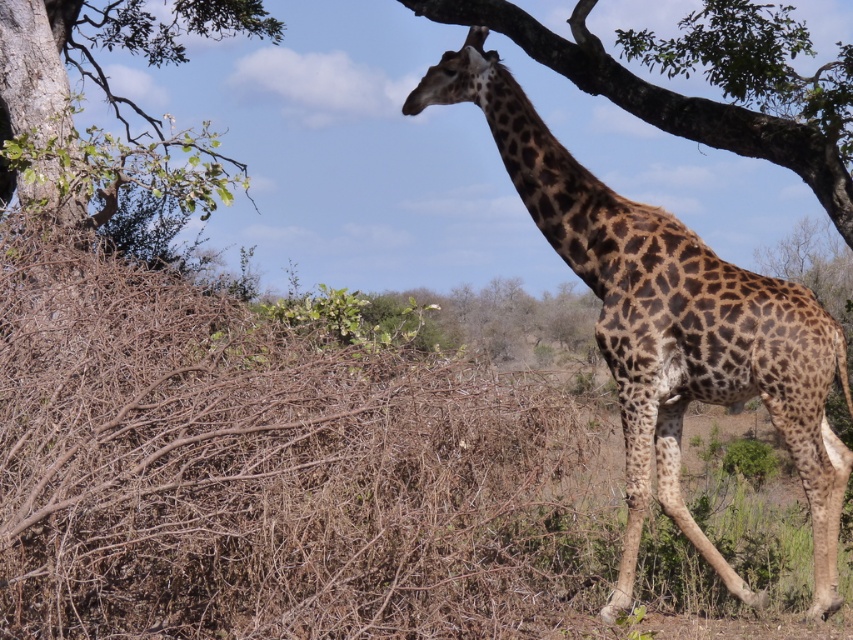
Which is below, spotted fur giraffe at center or green leafy tree at upper left?

spotted fur giraffe at center is lower down.

Is the position of spotted fur giraffe at center less distant than that of green leafy tree at upper left?

That is True.

Does point (631, 456) come farther from viewer compared to point (149, 186)?

No.

Where is `spotted fur giraffe at center`? This screenshot has width=853, height=640. spotted fur giraffe at center is located at coordinates (669, 324).